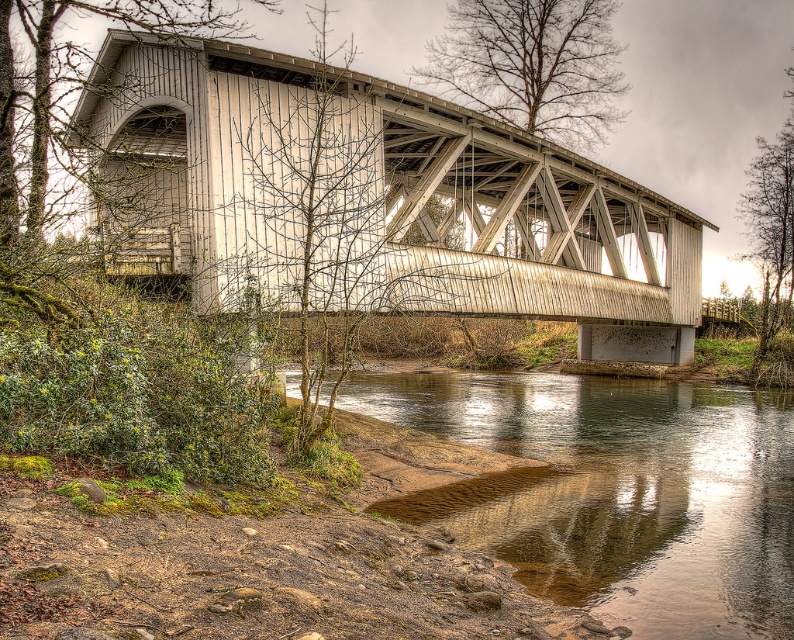
Question: Can you confirm if white wooden bridge at center is wider than brown sedimentary river at lower center?

Choices:
 (A) no
 (B) yes

Answer: (B)

Question: Which point appears closest to the camera in this image?

Choices:
 (A) (422, 291)
 (B) (584, 525)

Answer: (B)

Question: Which point is farther from the camera taking this photo?

Choices:
 (A) (576, 536)
 (B) (494, 168)

Answer: (B)

Question: Does white wooden bridge at center have a greater width compared to brown sedimentary river at lower center?

Choices:
 (A) no
 (B) yes

Answer: (B)

Question: Is white wooden bridge at center wider than brown sedimentary river at lower center?

Choices:
 (A) yes
 (B) no

Answer: (A)